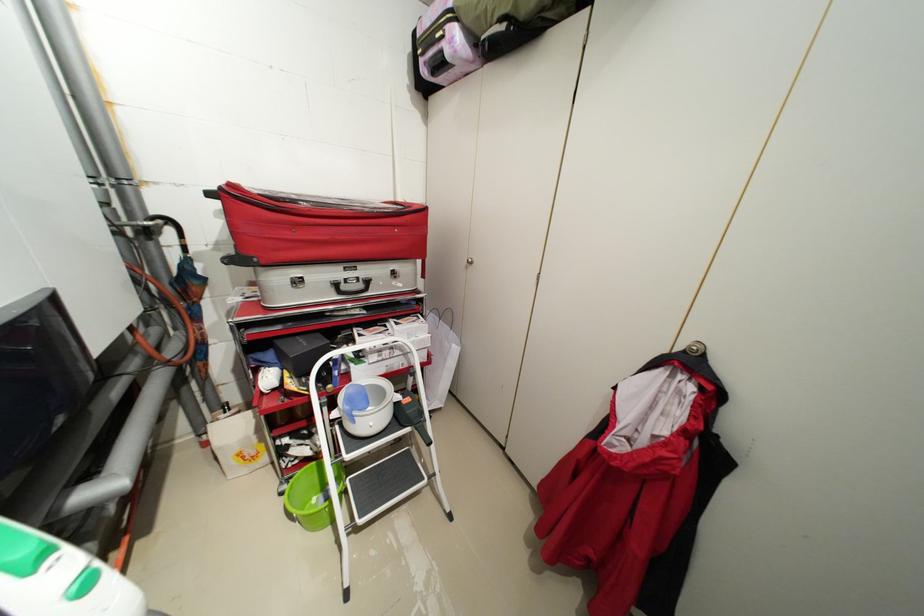
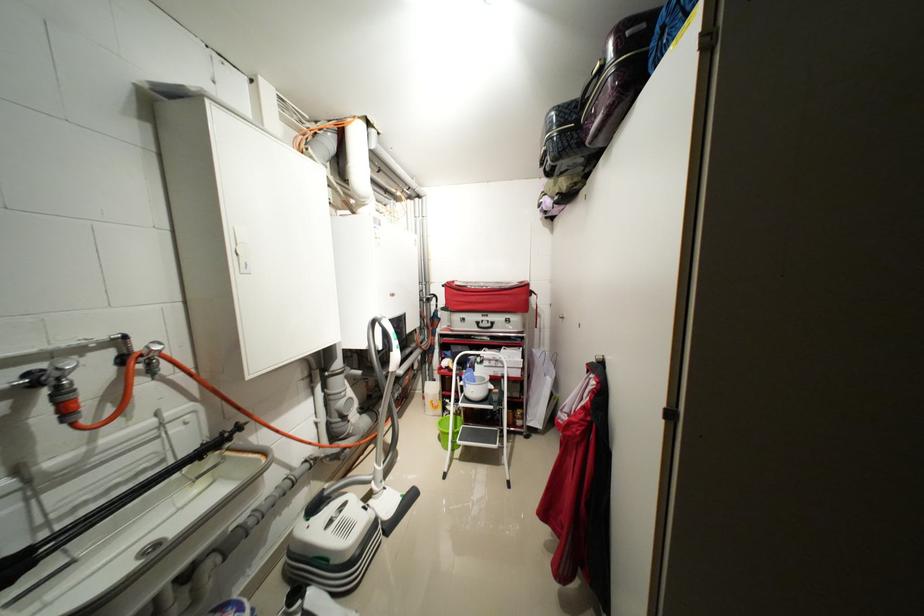
Locate, in the second image, the point that corresponds to the point at 237,185 in the first image.

(455, 284)